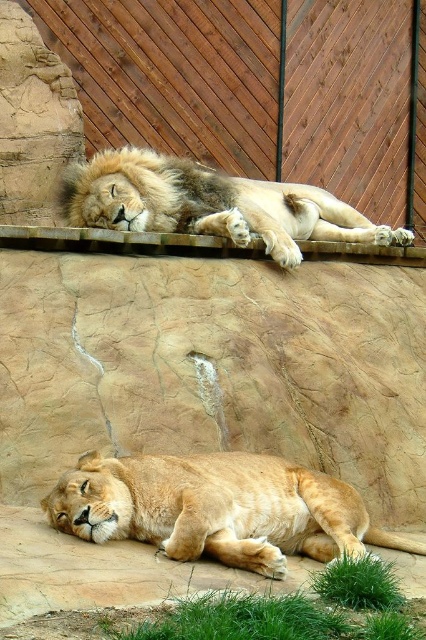
Can you confirm if golden fur lion at lower center is positioned above golden fur lion at upper center?

Incorrect, golden fur lion at lower center is not positioned above golden fur lion at upper center.

Is point (112, 481) less distant than point (187, 186)?

Yes, it is.

Which is in front, point (158, 508) or point (140, 205)?

Point (158, 508)

You are a GUI agent. You are given a task and a screenshot of the screen. Output one action in this format:
    pyautogui.click(x=<x>, y=<y>)
    Task: Click on the golden fur lion at lower center
    
    Given the screenshot: What is the action you would take?
    pyautogui.click(x=216, y=508)

Based on the photo, can you confirm if wooden fence at upper center is bigger than golden fur lion at upper center?

Correct, wooden fence at upper center is larger in size than golden fur lion at upper center.

Can you confirm if wooden fence at upper center is positioned above golden fur lion at upper center?

Correct, wooden fence at upper center is located above golden fur lion at upper center.

You are a GUI agent. You are given a task and a screenshot of the screen. Output one action in this format:
    pyautogui.click(x=<x>, y=<y>)
    Task: Click on the wooden fence at upper center
    The height and width of the screenshot is (640, 426).
    Given the screenshot: What is the action you would take?
    pyautogui.click(x=256, y=88)

You are a GUI agent. You are given a task and a screenshot of the screen. Output one action in this format:
    pyautogui.click(x=<x>, y=<y>)
    Task: Click on the wooden fence at upper center
    Image resolution: width=426 pixels, height=640 pixels.
    Given the screenshot: What is the action you would take?
    pyautogui.click(x=256, y=88)

Does wooden fence at upper center appear over golden fur lion at lower center?

Yes.

Does wooden fence at upper center have a larger size compared to golden fur lion at lower center?

Indeed, wooden fence at upper center has a larger size compared to golden fur lion at lower center.

Who is more forward, (313, 70) or (166, 516)?

Point (166, 516) is more forward.

Find the location of `wooden fence at upper center`. wooden fence at upper center is located at coordinates (256, 88).